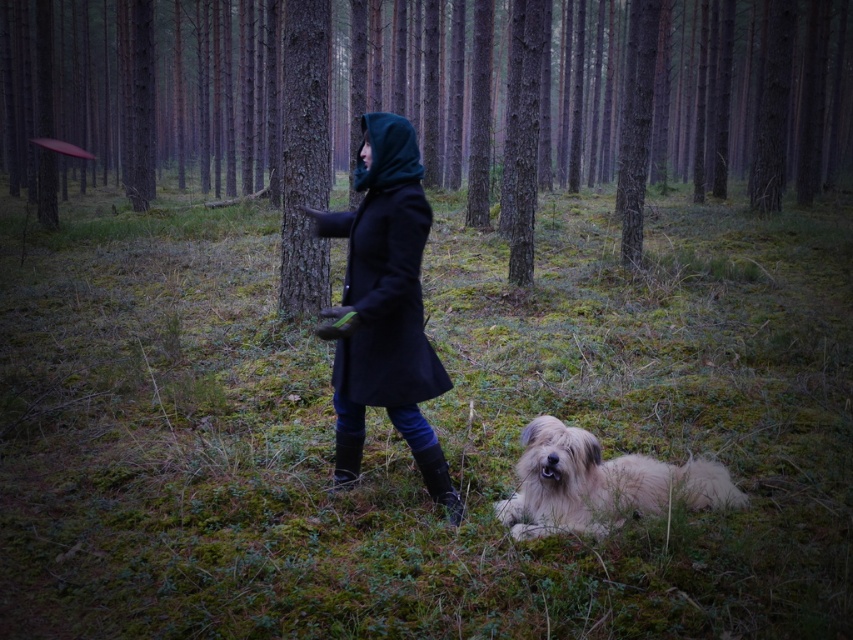
Question: Which object appears farthest from the camera in this image?

Choices:
 (A) smooth bark tree at center
 (B) fluffy beige dog at lower center
 (C) black matte coat at center

Answer: (A)

Question: Based on their relative distances, which object is nearer to the fluffy beige dog at lower center?

Choices:
 (A) smooth bark tree at center
 (B) brown rough tree at center

Answer: (A)

Question: Which point appears farthest from the camera in this image?

Choices:
 (A) (689, 502)
 (B) (323, 134)
 (C) (373, 378)
 (D) (669, 116)

Answer: (D)

Question: In this image, where is brown rough tree at center located relative to black matte coat at center?

Choices:
 (A) above
 (B) below

Answer: (A)

Question: Does brown rough tree at center appear on the right side of smooth bark tree at center?

Choices:
 (A) no
 (B) yes

Answer: (A)

Question: Where is brown rough tree at center located in relation to smooth bark tree at center in the image?

Choices:
 (A) below
 (B) above

Answer: (B)